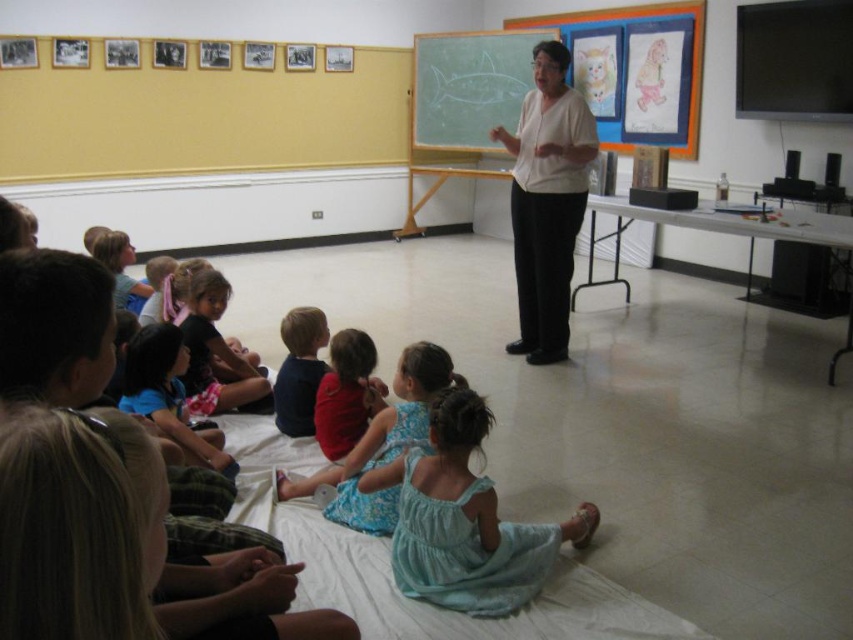
Where is `whiteboard at upper center`? Image resolution: width=853 pixels, height=640 pixels. whiteboard at upper center is located at coordinates (469, 86).

Measure the distance between whiteboard at upper center and camera.

whiteboard at upper center and camera are 20.81 feet apart.

The height and width of the screenshot is (640, 853). Find the location of `whiteboard at upper center`. whiteboard at upper center is located at coordinates (469, 86).

Who is lower down, whiteboard at upper center or dark blue shirt at center?

dark blue shirt at center is lower down.

The image size is (853, 640). I want to click on whiteboard at upper center, so click(469, 86).

Where is `whiteboard at upper center`? whiteboard at upper center is located at coordinates (469, 86).

How far apart are light pink fabric dress at lower left and dark blue shirt at center?

The distance of light pink fabric dress at lower left from dark blue shirt at center is 14.28 inches.

Which is more to the right, light pink fabric dress at lower left or dark blue shirt at center?

dark blue shirt at center

Between point (216, 272) and point (302, 429), which one is positioned in front?

Point (302, 429) is more forward.

This screenshot has width=853, height=640. In order to click on light pink fabric dress at lower left in this screenshot , I will do `click(216, 353)`.